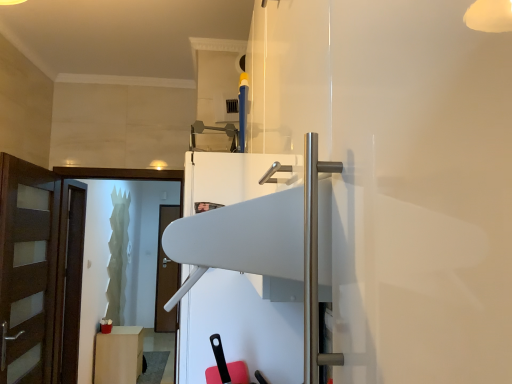
Question: Can we say matte white cabinet at lower left lies outside transparent glass screen door at left?

Choices:
 (A) yes
 (B) no

Answer: (A)

Question: Considering the relative sizes of matte white cabinet at lower left and transparent glass screen door at left in the image provided, is matte white cabinet at lower left shorter than transparent glass screen door at left?

Choices:
 (A) no
 (B) yes

Answer: (B)

Question: From the image's perspective, would you say matte white cabinet at lower left is positioned over transparent glass screen door at left?

Choices:
 (A) no
 (B) yes

Answer: (A)

Question: Is matte white cabinet at lower left not close to transparent glass screen door at left?

Choices:
 (A) yes
 (B) no

Answer: (A)

Question: Does matte white cabinet at lower left have a larger size compared to transparent glass screen door at left?

Choices:
 (A) no
 (B) yes

Answer: (A)

Question: In terms of width, does white glossy fridge at center look wider or thinner when compared to brown wooden door at left?

Choices:
 (A) thin
 (B) wide

Answer: (B)

Question: Considering their positions, is white glossy fridge at center located in front of or behind brown wooden door at left?

Choices:
 (A) behind
 (B) front

Answer: (B)

Question: Based on their positions, is white glossy fridge at center located to the left or right of brown wooden door at left?

Choices:
 (A) right
 (B) left

Answer: (A)

Question: From a real-world perspective, is white glossy fridge at center positioned above or below brown wooden door at left?

Choices:
 (A) below
 (B) above

Answer: (B)

Question: Is matte white cabinet at lower left inside or outside of white glossy fridge at center?

Choices:
 (A) inside
 (B) outside

Answer: (B)

Question: Considering the positions of matte white cabinet at lower left and white glossy fridge at center in the image, is matte white cabinet at lower left taller or shorter than white glossy fridge at center?

Choices:
 (A) short
 (B) tall

Answer: (A)

Question: Looking at their shapes, would you say matte white cabinet at lower left is wider or thinner than white glossy fridge at center?

Choices:
 (A) thin
 (B) wide

Answer: (A)

Question: Considering the positions of matte white cabinet at lower left and white glossy fridge at center in the image, is matte white cabinet at lower left bigger or smaller than white glossy fridge at center?

Choices:
 (A) small
 (B) big

Answer: (A)

Question: Is transparent glass screen door at left wider or thinner than brown wooden door at left?

Choices:
 (A) wide
 (B) thin

Answer: (B)

Question: Would you say transparent glass screen door at left is inside or outside brown wooden door at left?

Choices:
 (A) outside
 (B) inside

Answer: (A)